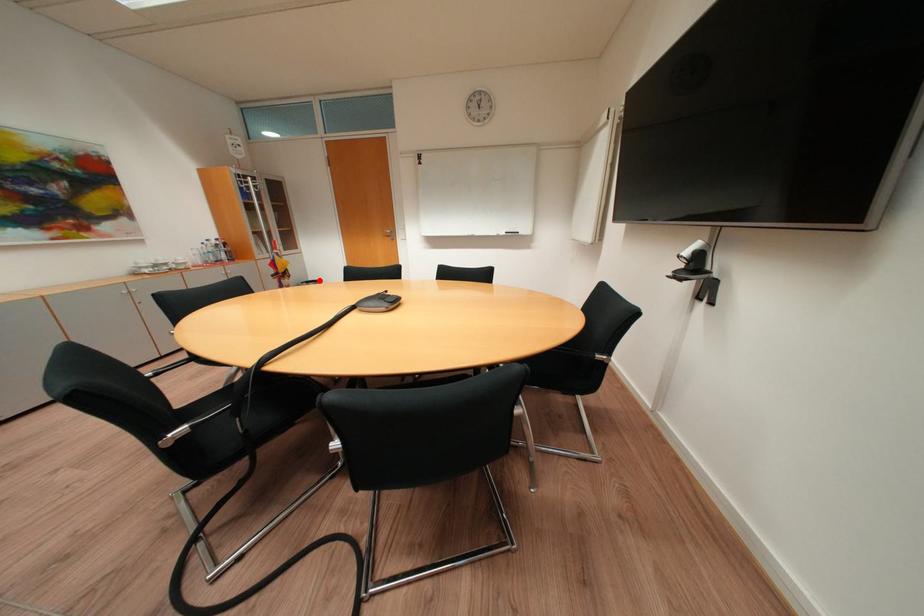
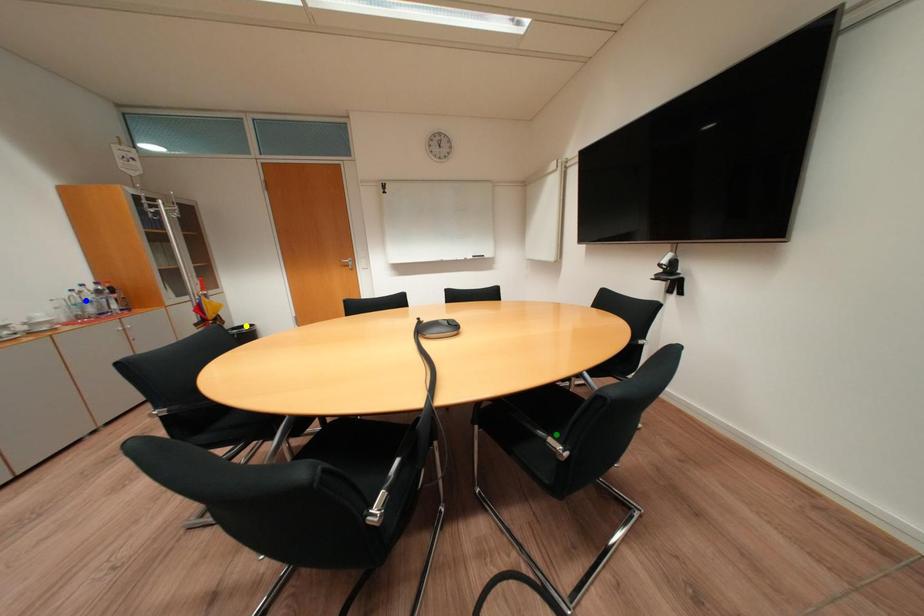
Question: I am providing you with two images of the same scene from different viewpoints. A red point is marked on the first image. You are given multiple points on the second image. Which point in image 2 is actually the same real-world point as the red point in image 1?

Choices:
 (A) blue point
 (B) yellow point
 (C) green point

Answer: (B)